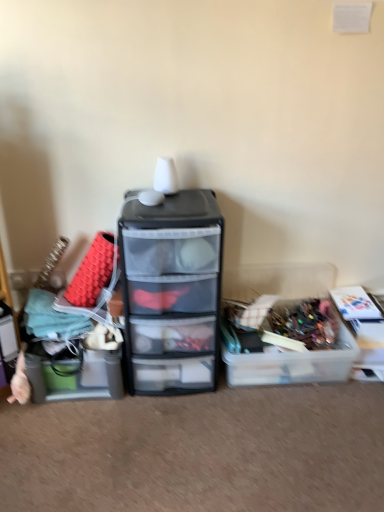
Where is `free spot above transparent plastic drawers at center (from a real-world perspective)`? Image resolution: width=384 pixels, height=512 pixels. free spot above transparent plastic drawers at center (from a real-world perspective) is located at coordinates (166, 198).